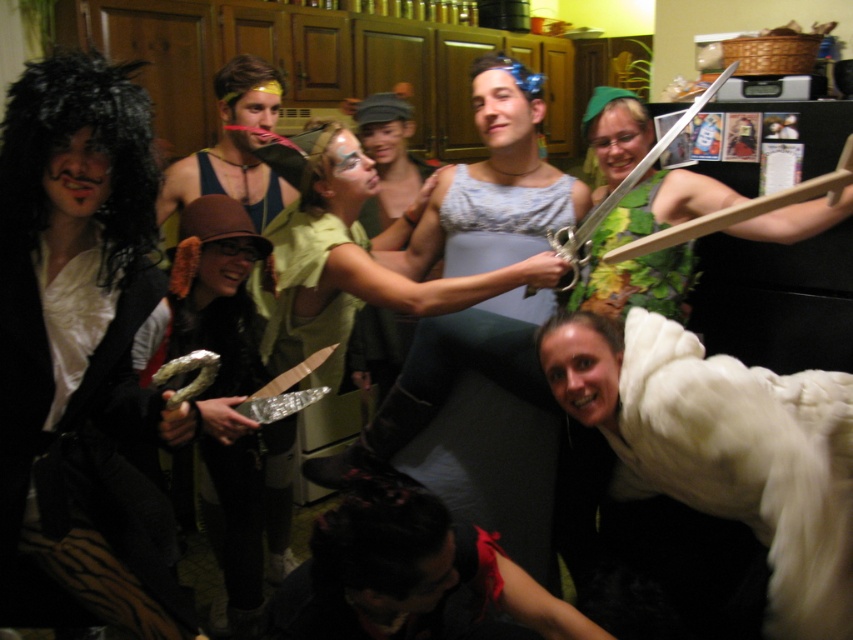
Who is positioned more to the left, shiny black wig at left or green fabric dress at center?

shiny black wig at left is more to the left.

Who is lower down, shiny black wig at left or green fabric dress at center?

shiny black wig at left

You are a GUI agent. You are given a task and a screenshot of the screen. Output one action in this format:
    pyautogui.click(x=<x>, y=<y>)
    Task: Click on the shiny black wig at left
    The image size is (853, 640).
    Given the screenshot: What is the action you would take?
    pyautogui.click(x=74, y=323)

Is shiny black wig at left above white fluffy coat at lower right?

Yes, shiny black wig at left is above white fluffy coat at lower right.

The image size is (853, 640). What do you see at coordinates (74, 323) in the screenshot?
I see `shiny black wig at left` at bounding box center [74, 323].

Is point (126, 426) in front of point (817, 580)?

No, it is behind (817, 580).

You are a GUI agent. You are given a task and a screenshot of the screen. Output one action in this format:
    pyautogui.click(x=<x>, y=<y>)
    Task: Click on the shiny black wig at left
    
    Given the screenshot: What is the action you would take?
    pyautogui.click(x=74, y=323)

Can you confirm if black velvet mask at lower center is positioned to the right of brown fabric hat at center?

Indeed, black velvet mask at lower center is positioned on the right side of brown fabric hat at center.

Is black velvet mask at lower center below brown fabric hat at center?

Yes, black velvet mask at lower center is below brown fabric hat at center.

The height and width of the screenshot is (640, 853). Describe the element at coordinates (409, 577) in the screenshot. I see `black velvet mask at lower center` at that location.

Image resolution: width=853 pixels, height=640 pixels. I want to click on black velvet mask at lower center, so click(x=409, y=577).